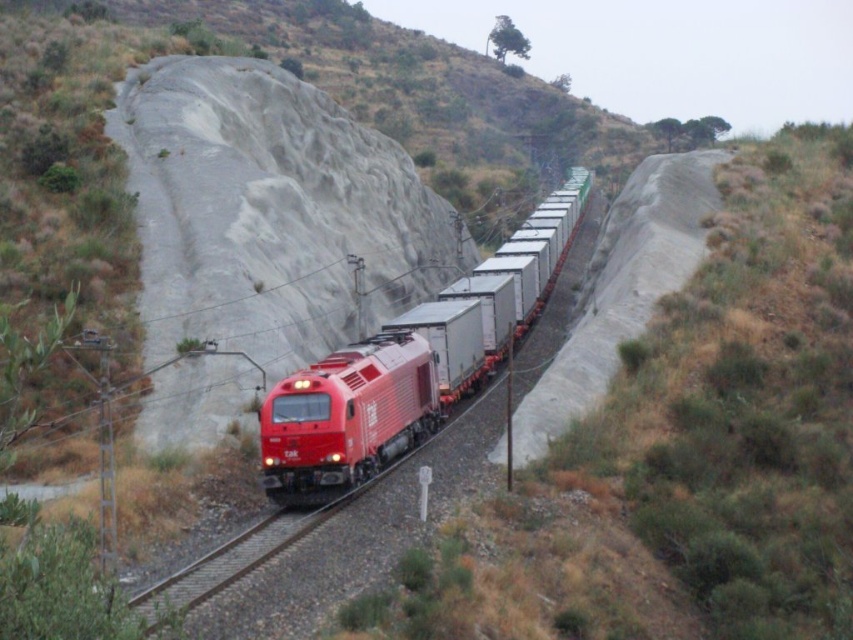
Which is behind, point (317, 477) or point (148, 609)?

Point (317, 477)

Looking at this image, does metallic red train at center have a greater width compared to metal train track at center?

Correct, the width of metallic red train at center exceeds that of metal train track at center.

Which is in front, point (494, 314) or point (297, 536)?

Point (297, 536) is more forward.

Identify the location of metallic red train at center. This screenshot has width=853, height=640. (369, 401).